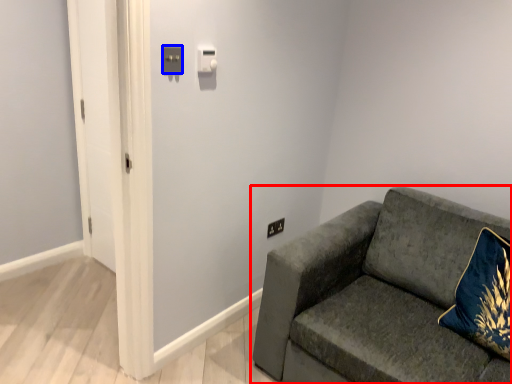
Question: Which object appears farthest to the camera in this image, studio couch (highlighted by a red box) or light switch (highlighted by a blue box)?

Choices:
 (A) studio couch
 (B) light switch

Answer: (B)